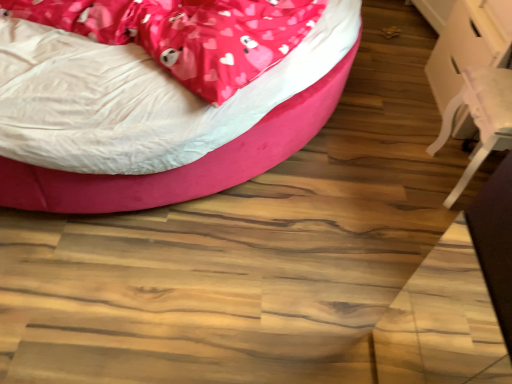
Describe the element at coordinates (480, 118) in the screenshot. I see `white plastic swivel chair at right` at that location.

What is the approximate width of white glossy table at right?

white glossy table at right is 16.22 inches wide.

What do you see at coordinates (468, 44) in the screenshot?
I see `white glossy table at right` at bounding box center [468, 44].

This screenshot has width=512, height=384. What do you see at coordinates (188, 34) in the screenshot?
I see `pink satin blanket at upper left` at bounding box center [188, 34].

I want to click on white plastic swivel chair at right, so click(x=480, y=118).

The height and width of the screenshot is (384, 512). In the image, there is a pink satin blanket at upper left. What are the coordinates of `swivel chair below it (from a real-world perspective)` in the screenshot? It's located at (480, 118).

Is pink satin blanket at upper left bigger or smaller than white plastic swivel chair at right?

Clearly, pink satin blanket at upper left is larger in size than white plastic swivel chair at right.

In terms of height, does pink satin blanket at upper left look taller or shorter compared to white plastic swivel chair at right?

In the image, pink satin blanket at upper left appears to be shorter than white plastic swivel chair at right.

From a real-world perspective, relative to white plastic swivel chair at right, is pink satin blanket at upper left vertically above or below?

pink satin blanket at upper left is situated higher than white plastic swivel chair at right in the real world.

Identify the location of blanket in front of the white glossy table at right. (188, 34).

Is pink satin blanket at upper left inside or outside of white glossy table at right?

The correct answer is: outside.

From a real-world perspective, which is physically above, pink satin blanket at upper left or white glossy table at right?

From a 3D spatial view, pink satin blanket at upper left is above.

From the image's perspective, relative to white plastic swivel chair at right, is white glossy table at right above or below?

white glossy table at right is above white plastic swivel chair at right.

In terms of size, does white glossy table at right appear bigger or smaller than white plastic swivel chair at right?

Considering their sizes, white glossy table at right takes up more space than white plastic swivel chair at right.

Considering the relative positions of white glossy table at right and white plastic swivel chair at right in the image provided, is white glossy table at right to the right of white plastic swivel chair at right from the viewer's perspective?

Indeed, white glossy table at right is positioned on the right side of white plastic swivel chair at right.

Considering the sizes of objects white glossy table at right and white plastic swivel chair at right in the image provided, who is taller, white glossy table at right or white plastic swivel chair at right?

white glossy table at right is taller.

From the image's perspective, between white glossy table at right and velvet pink bed at upper left, which one is located above?

velvet pink bed at upper left appears higher in the image.

Is white glossy table at right aimed at velvet pink bed at upper left?

Yes, white glossy table at right is aimed at velvet pink bed at upper left.

Considering the sizes of white glossy table at right and velvet pink bed at upper left in the image, is white glossy table at right taller or shorter than velvet pink bed at upper left?

Considering their sizes, white glossy table at right has more height than velvet pink bed at upper left.

Does white glossy table at right have a greater width compared to velvet pink bed at upper left?

No, white glossy table at right is not wider than velvet pink bed at upper left.

Consider the image. Considering the sizes of objects velvet pink bed at upper left and pink satin blanket at upper left in the image provided, who is bigger, velvet pink bed at upper left or pink satin blanket at upper left?

With larger size is velvet pink bed at upper left.

Considering the sizes of objects velvet pink bed at upper left and pink satin blanket at upper left in the image provided, who is shorter, velvet pink bed at upper left or pink satin blanket at upper left?

With less height is velvet pink bed at upper left.

From the picture: Which of these two, velvet pink bed at upper left or pink satin blanket at upper left, is thinner?

Thinner between the two is pink satin blanket at upper left.

Would you consider velvet pink bed at upper left to be distant from pink satin blanket at upper left?

No, there isn't a large distance between velvet pink bed at upper left and pink satin blanket at upper left.

Identify the location of blanket above the white plastic swivel chair at right (from the image's perspective). tap(188, 34).

In the scene shown: Does white plastic swivel chair at right have a greater width compared to pink satin blanket at upper left?

Incorrect, the width of white plastic swivel chair at right does not surpass that of pink satin blanket at upper left.

How different are the orientations of white plastic swivel chair at right and pink satin blanket at upper left in degrees?

159 degrees separate the facing orientations of white plastic swivel chair at right and pink satin blanket at upper left.

Is pink satin blanket at upper left located within white plastic swivel chair at right?

No.

In terms of width, does white plastic swivel chair at right look wider or thinner when compared to white glossy table at right?

Clearly, white plastic swivel chair at right has less width compared to white glossy table at right.

Locate an element on the screen. swivel chair that appears on the left of white glossy table at right is located at coordinates (480, 118).

Between point (461, 90) and point (449, 44), which one is positioned behind?

The point (449, 44) is farther.

Considering the relative positions of white plastic swivel chair at right and white glossy table at right in the image provided, is white plastic swivel chair at right behind white glossy table at right?

No, white plastic swivel chair at right is closer to the viewer.

Locate an element on the screen. swivel chair on the right of pink satin blanket at upper left is located at coordinates (480, 118).

This screenshot has width=512, height=384. In order to click on blanket above the white glossy table at right (from a real-world perspective) in this screenshot , I will do `click(188, 34)`.

Estimate the real-world distances between objects in this image. Which object is closer to white plastic swivel chair at right, pink satin blanket at upper left or velvet pink bed at upper left?

Among the two, velvet pink bed at upper left is located nearer to white plastic swivel chair at right.

Considering their positions, is white glossy table at right positioned further to white plastic swivel chair at right than pink satin blanket at upper left?

pink satin blanket at upper left is positioned further to the anchor white plastic swivel chair at right.

Estimate the real-world distances between objects in this image. Which object is further from white glossy table at right, velvet pink bed at upper left or pink satin blanket at upper left?

pink satin blanket at upper left.

Consider the image. Based on their spatial positions, is white plastic swivel chair at right or velvet pink bed at upper left closer to white glossy table at right?

white plastic swivel chair at right lies closer to white glossy table at right than the other object.

When comparing their distances from velvet pink bed at upper left, does pink satin blanket at upper left or white plastic swivel chair at right seem closer?

pink satin blanket at upper left lies closer to velvet pink bed at upper left than the other object.

Considering their positions, is velvet pink bed at upper left positioned closer to white plastic swivel chair at right than white glossy table at right?

white glossy table at right is closer to white plastic swivel chair at right.

Which object lies further to the anchor point white plastic swivel chair at right, pink satin blanket at upper left or white glossy table at right?

Among the two, pink satin blanket at upper left is located further to white plastic swivel chair at right.

Which object lies nearer to the anchor point pink satin blanket at upper left, velvet pink bed at upper left or white glossy table at right?

velvet pink bed at upper left is closer to pink satin blanket at upper left.

Where is `swivel chair between pink satin blanket at upper left and white glossy table at right from left to right`? This screenshot has width=512, height=384. swivel chair between pink satin blanket at upper left and white glossy table at right from left to right is located at coordinates (480, 118).

This screenshot has height=384, width=512. In order to click on blanket located between velvet pink bed at upper left and white plastic swivel chair at right in the left-right direction in this screenshot , I will do `click(188, 34)`.

This screenshot has height=384, width=512. In order to click on blanket between velvet pink bed at upper left and white glossy table at right in the horizontal direction in this screenshot , I will do `click(188, 34)`.

Find the location of a particular element. This screenshot has height=384, width=512. swivel chair located between velvet pink bed at upper left and white glossy table at right in the left-right direction is located at coordinates (480, 118).